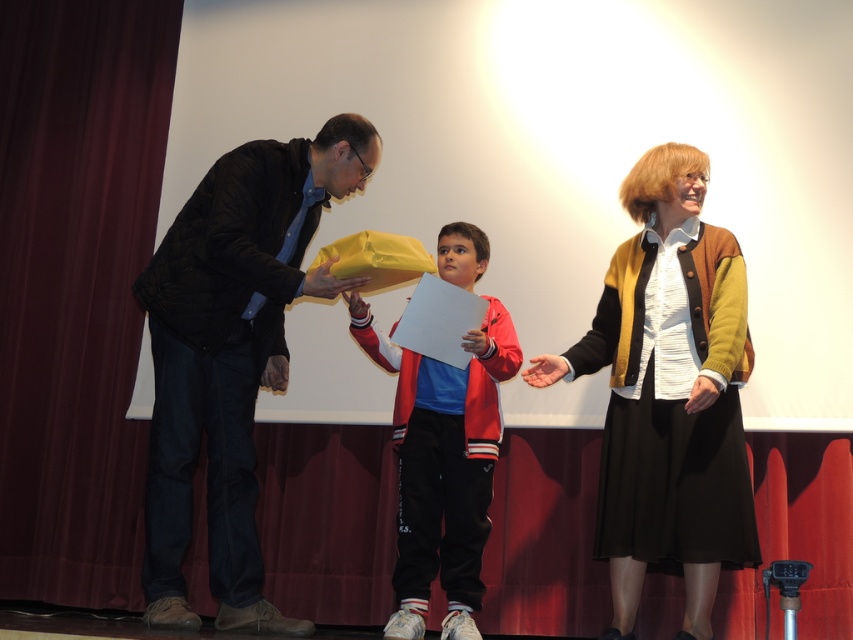
Based on the photo, you are standing at the stage edge and want to move from the maroon fabric curtain at left to the man handing the gift to the boy. Can you walk directly between them without needing to move any objects?

The distance between the maroon fabric curtain at left and the man handing the gift to the boy is 4.11 meters, so yes, you can walk directly between them without needing to move any objects since the space is sufficient.

You are a stagehand preparing to move the maroon fabric curtain at left and the matte black jacket at left. Which object is positioned higher?

The maroon fabric curtain at left is located above the matte black jacket at left, so it is positioned higher.

In the scene shown: You are a photographer taking a photo of the two individuals at the center of the stage. You need to ensure both the black woolen cardigan at center and the matte red jacket at center are clearly visible in the frame. Which one should you focus on first to ensure proper exposure, considering their positions?

The black woolen cardigan at center is positioned on the right side of matte red jacket at center. Since the photographer should focus on the closest subject first, you should focus on the matte red jacket at center first as it is closer to the camera.